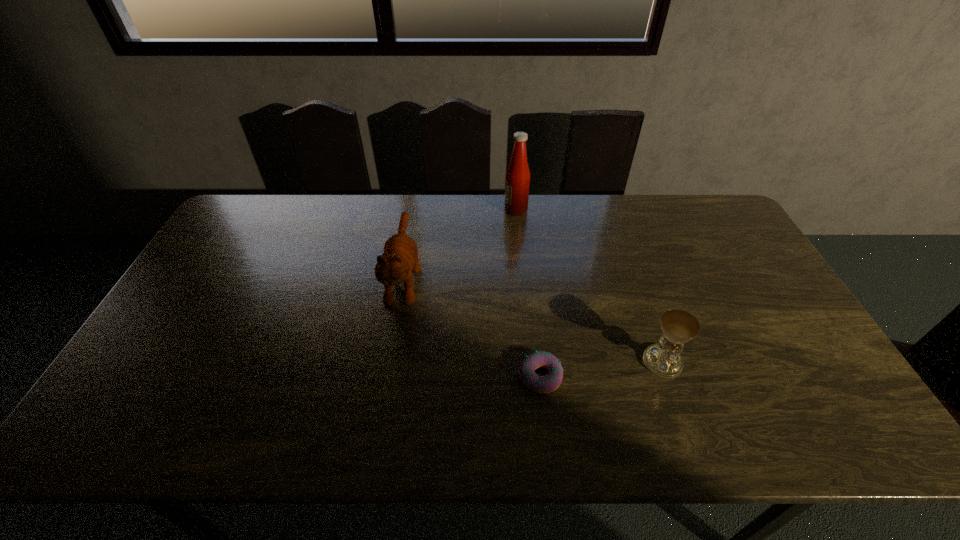
Identify the location of the tallest object. The width and height of the screenshot is (960, 540). (517, 182).

Locate an element on the screen. condiment is located at coordinates (517, 182).

You are a GUI agent. You are given a task and a screenshot of the screen. Output one action in this format:
    pyautogui.click(x=<x>, y=<y>)
    Task: Click on the second farthest object
    Image resolution: width=960 pixels, height=540 pixels.
    Given the screenshot: What is the action you would take?
    pyautogui.click(x=400, y=258)

This screenshot has height=540, width=960. Identify the location of the leftmost object. (400, 258).

Where is `the second shortest object`? The image size is (960, 540). the second shortest object is located at coordinates (678, 326).

Locate an element on the screen. This screenshot has height=540, width=960. chalice is located at coordinates (678, 326).

Identify the location of doughnut. (548, 383).

This screenshot has width=960, height=540. Identify the location of blank space located 0.390m on the front-facing side of the tallest object. (396, 210).

Where is `free spot located 0.130m on the front-facing side of the tallest object`? The width and height of the screenshot is (960, 540). free spot located 0.130m on the front-facing side of the tallest object is located at coordinates point(468,210).

You are a GUI agent. You are given a task and a screenshot of the screen. Output one action in this format:
    pyautogui.click(x=<x>, y=<y>)
    Task: Click on the vacant region located 0.100m on the front-facing side of the tallest object
    Image resolution: width=960 pixels, height=540 pixels.
    Given the screenshot: What is the action you would take?
    pyautogui.click(x=476, y=210)